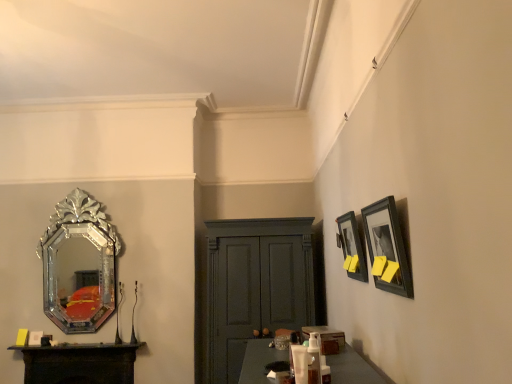
Question: From a real-world perspective, is silver/glass mirror at left above or below dark wood table at lower left?

Choices:
 (A) below
 (B) above

Answer: (B)

Question: Considering the positions of silver/glass mirror at left and dark wood table at lower left in the image, is silver/glass mirror at left taller or shorter than dark wood table at lower left?

Choices:
 (A) tall
 (B) short

Answer: (A)

Question: Which object is positioned farthest from the dark wood table at lower left?

Choices:
 (A) black matte picture frame at upper right, arranged as the 1th picture frame when viewed from the front
 (B) silver/glass mirror at left
 (C) translucent plastic bottle at center, which is counted as the 1th toiletry, starting from the back
 (D) matte black picture frame at upper right, the second picture frame viewed from the front
 (E) translucent plastic pump bottle at center, the first toiletry in the right-to-left sequence

Answer: (A)

Question: Which object is the farthest from the black matte picture frame at upper right, arranged as the 1th picture frame when viewed from the front?

Choices:
 (A) silver/glass mirror at left
 (B) matte black picture frame at upper right, marked as the first picture frame in a back-to-front arrangement
 (C) translucent plastic pump bottle at center, placed as the second toiletry when sorted from left to right
 (D) matte gray cabinet at center
 (E) translucent plastic bottle at center, the second toiletry positioned from the right

Answer: (A)